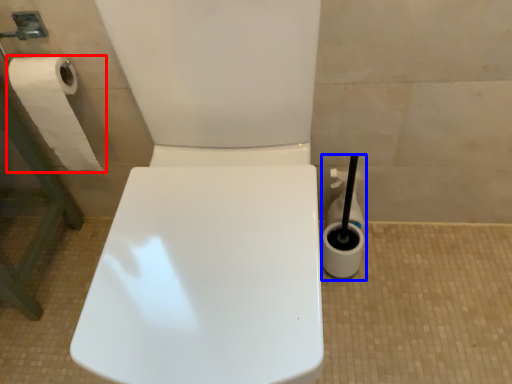
Question: Which of the following is the closest to the observer, toilet paper (highlighted by a red box) or cleaning product (highlighted by a blue box)?

Choices:
 (A) toilet paper
 (B) cleaning product

Answer: (A)